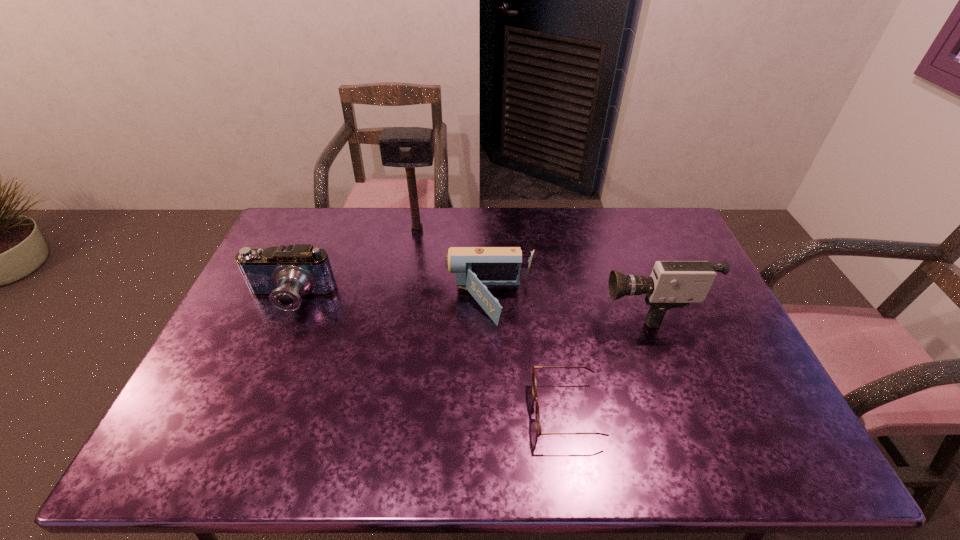
You are a GUI agent. You are given a task and a screenshot of the screen. Output one action in this format:
    pyautogui.click(x=<x>, y=<y>)
    Task: Click on the vacant point located between the leftmost camcorder and the rightmost object
    This screenshot has height=540, width=960.
    Given the screenshot: What is the action you would take?
    468,303

Find the location of a particular element. Image resolution: width=960 pixels, height=540 pixels. unoccupied position between the nearest object and the tallest object is located at coordinates (492, 321).

The width and height of the screenshot is (960, 540). I want to click on unoccupied position between the second object from left to right and the shortest object, so click(492, 321).

Locate an element on the screen. This screenshot has height=540, width=960. free space between the second object from left to right and the leftmost object is located at coordinates (353, 266).

Where is `free spot between the second camcorder from right to left and the nearest object`? The width and height of the screenshot is (960, 540). free spot between the second camcorder from right to left and the nearest object is located at coordinates (528, 357).

Locate which object ranks second in proximity to the rightmost object. Please provide its 2D coordinates. Your answer should be formatted as a tuple, i.e. [(x, y)], where the tuple contains the x and y coordinates of a point satisfying the conditions above.

[(476, 268)]

The height and width of the screenshot is (540, 960). Identify the location of the second closest object to the rightmost object. (476, 268).

Identify which camcorder is the second nearest to the rightmost camcorder. Please provide its 2D coordinates. Your answer should be formatted as a tuple, i.e. [(x, y)], where the tuple contains the x and y coordinates of a point satisfying the conditions above.

[(284, 273)]

The width and height of the screenshot is (960, 540). I want to click on the second closest camcorder to the second camcorder from left to right, so click(284, 273).